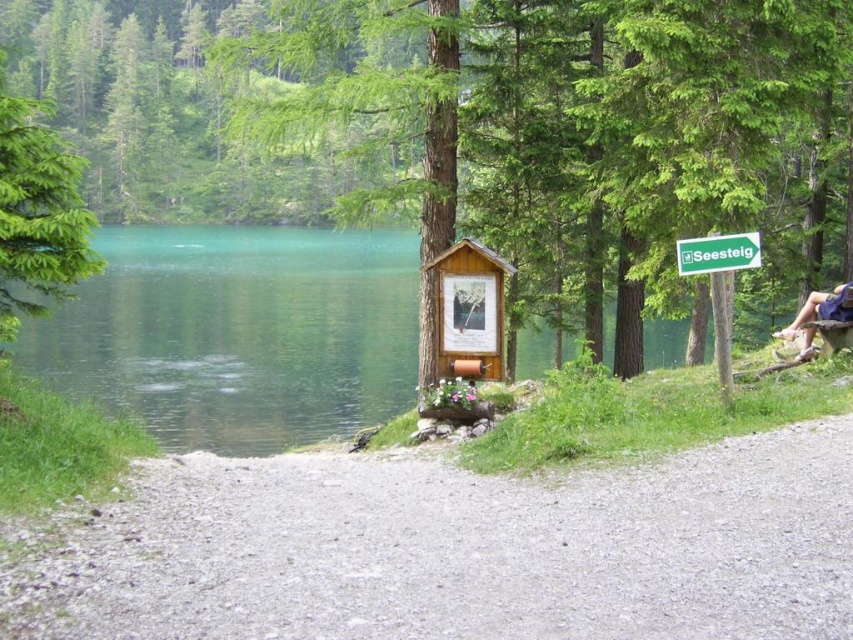
You are standing at the lakeside and want to reach a specific point marked at coordinates point (82, 332). If your walking speed is 1.2 meters per second, how many seconds will it take you to reach that point?

The point (82, 332) is 50.37 meters away from the viewer. At a walking speed of 1.2 meters per second, it will take approximately 41.98 seconds to reach the point.

You are a park ranger who needs to place a new 1.5 meter wide information board between the green matte tree at upper left and the brown wooden bench at right. Can you fit it without moving either object?

The distance between the green matte tree at upper left and the brown wooden bench at right is 13.49 meters. Since the information board is only 1.5 meters wide, there is sufficient space to place it between them without moving either object.

You are standing at the lakeside and want to place a 1.5 meter long wooden bench between the green glossy water at left and the blue denim shorts at right. Is there enough space to place the bench without moving either object?

The distance between the green glossy water at left and the blue denim shorts at right is 42.04 meters. Since the bench is only 1.5 meters long, there is plenty of space to place it between them without moving either object.